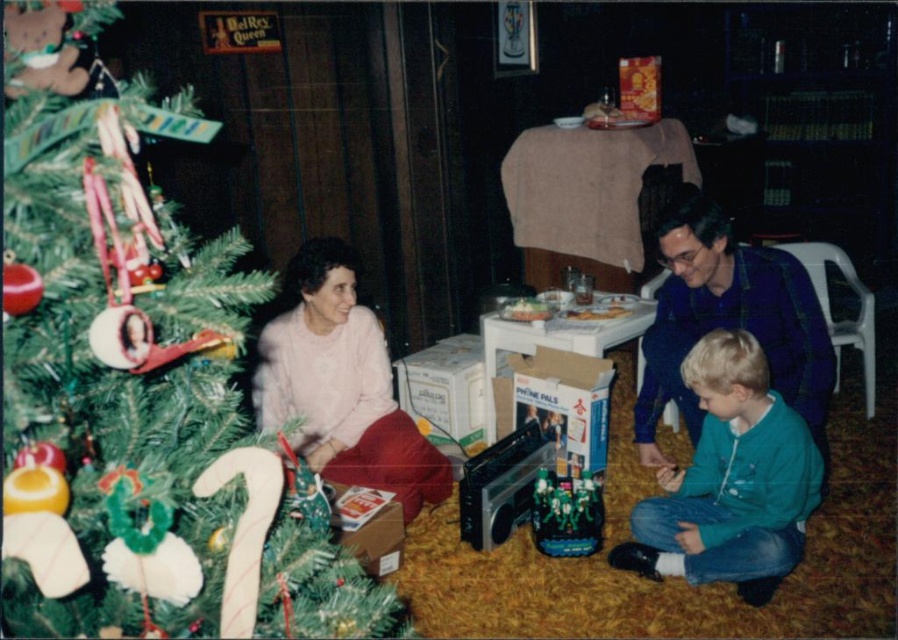
Question: Which point is farther from the camera taking this photo?

Choices:
 (A) (239, 636)
 (B) (367, 468)

Answer: (B)

Question: Among these points, which one is farthest from the camera?

Choices:
 (A) (15, 163)
 (B) (319, 460)
 (C) (772, 556)

Answer: (B)

Question: Does green matte christmas tree at left appear under pink fabric at lower left?

Choices:
 (A) yes
 (B) no

Answer: (A)

Question: In this image, where is green matte christmas tree at left located relative to teal fleece jacket at lower right?

Choices:
 (A) right
 (B) left

Answer: (B)

Question: In this image, where is green matte christmas tree at left located relative to pink fabric at lower left?

Choices:
 (A) left
 (B) right

Answer: (B)

Question: Based on their relative distances, which object is farther from the teal fleece jacket at lower right?

Choices:
 (A) green matte christmas tree at left
 (B) pink fabric at lower left

Answer: (A)